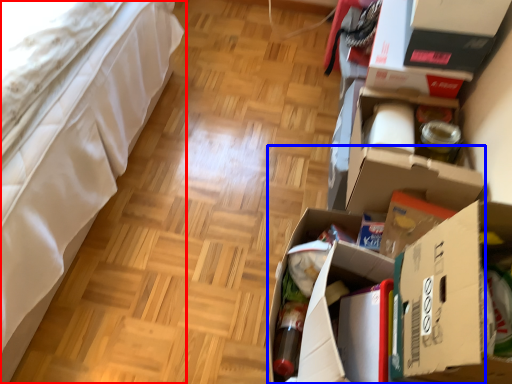
Question: Which object appears closest to the camera in this image, furniture (highlighted by a red box) or cardboard box (highlighted by a blue box)?

Choices:
 (A) furniture
 (B) cardboard box

Answer: (A)